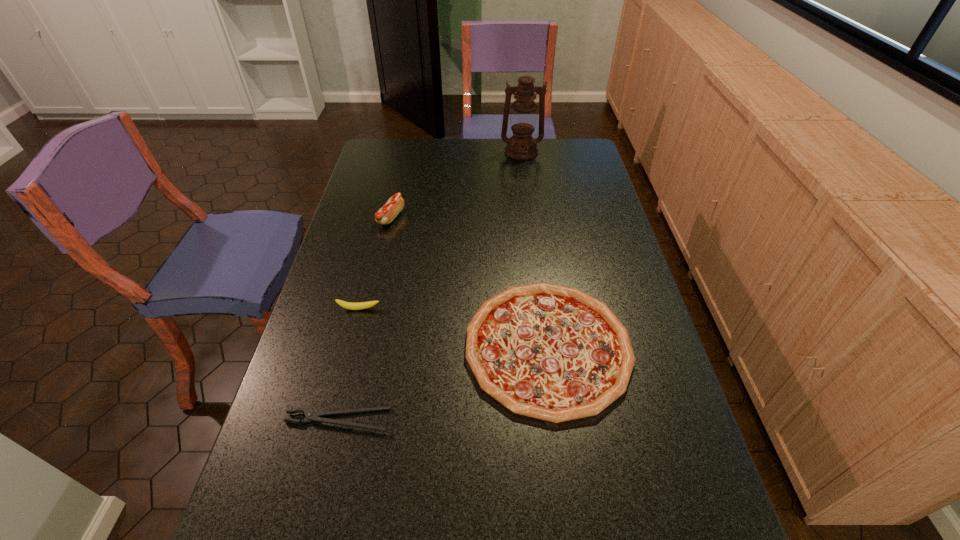
The image size is (960, 540). I want to click on empty space that is in between the tongs and the tallest object, so click(x=429, y=286).

This screenshot has width=960, height=540. Find the location of `unoccupied area between the shortest object and the oil lamp`. unoccupied area between the shortest object and the oil lamp is located at coordinates (429, 286).

Identify the location of vacant space that is in between the banana and the fourth tallest object. The height and width of the screenshot is (540, 960). (453, 328).

You are a GUI agent. You are given a task and a screenshot of the screen. Output one action in this format:
    pyautogui.click(x=<x>, y=<y>)
    Task: Click on the free space between the banana and the pizza
    The width and height of the screenshot is (960, 540).
    Given the screenshot: What is the action you would take?
    pyautogui.click(x=453, y=328)

Where is `unoccupied position between the sausage and the pizza`? The width and height of the screenshot is (960, 540). unoccupied position between the sausage and the pizza is located at coordinates (469, 282).

This screenshot has height=540, width=960. I want to click on free space between the banana and the pizza, so click(x=453, y=328).

The image size is (960, 540). Find the location of `empty space between the fourth tallest object and the tongs`. empty space between the fourth tallest object and the tongs is located at coordinates (443, 384).

Locate an element on the screen. Image resolution: width=960 pixels, height=540 pixels. blank region between the shortest object and the second tallest object is located at coordinates (364, 319).

The image size is (960, 540). I want to click on free space between the banana and the second tallest object, so click(375, 264).

Locate an element on the screen. The image size is (960, 540). unoccupied position between the tongs and the farthest object is located at coordinates (429, 286).